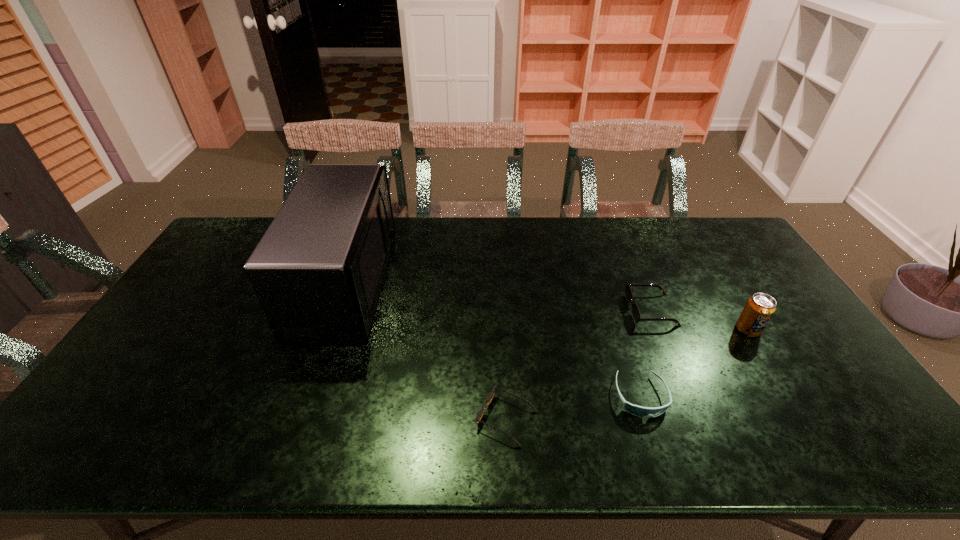
Find the location of a particular element. This screenshot has width=960, height=540. vacant space located 0.150m on the back of the rightmost object is located at coordinates (722, 287).

You are a GUI agent. You are given a task and a screenshot of the screen. Output one action in this format:
    pyautogui.click(x=<x>, y=<y>)
    Task: Click on the free space located 0.060m on the front-facing side of the taller sunglasses
    Image resolution: width=960 pixels, height=540 pixels.
    Given the screenshot: What is the action you would take?
    pyautogui.click(x=609, y=309)

This screenshot has height=540, width=960. In order to click on free location located 0.390m on the front-facing side of the taller sunglasses in this screenshot , I will do `click(500, 309)`.

Locate an element on the screen. The height and width of the screenshot is (540, 960). free spot located 0.190m on the front-facing side of the taller sunglasses is located at coordinates (565, 309).

Where is `free region located 0.090m on the front-facing side of the goggles`? This screenshot has width=960, height=540. free region located 0.090m on the front-facing side of the goggles is located at coordinates (660, 456).

Where is `free location located on the lenses of the left sunglasses`? free location located on the lenses of the left sunglasses is located at coordinates (312, 419).

Where is `blank space located on the lenses of the left sunglasses`? blank space located on the lenses of the left sunglasses is located at coordinates (362, 419).

Find the location of a particular element. Image resolution: width=960 pixels, height=540 pixels. free space located on the lenses of the left sunglasses is located at coordinates (441, 419).

Where is `object at the far edge`? object at the far edge is located at coordinates (318, 271).

In order to click on object present at the near edge in this screenshot , I will do `click(489, 398)`.